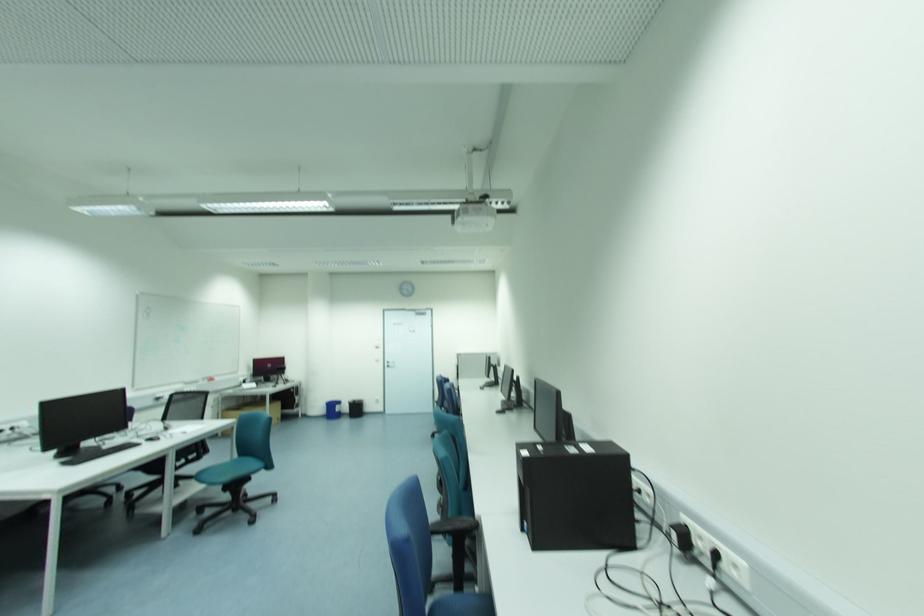
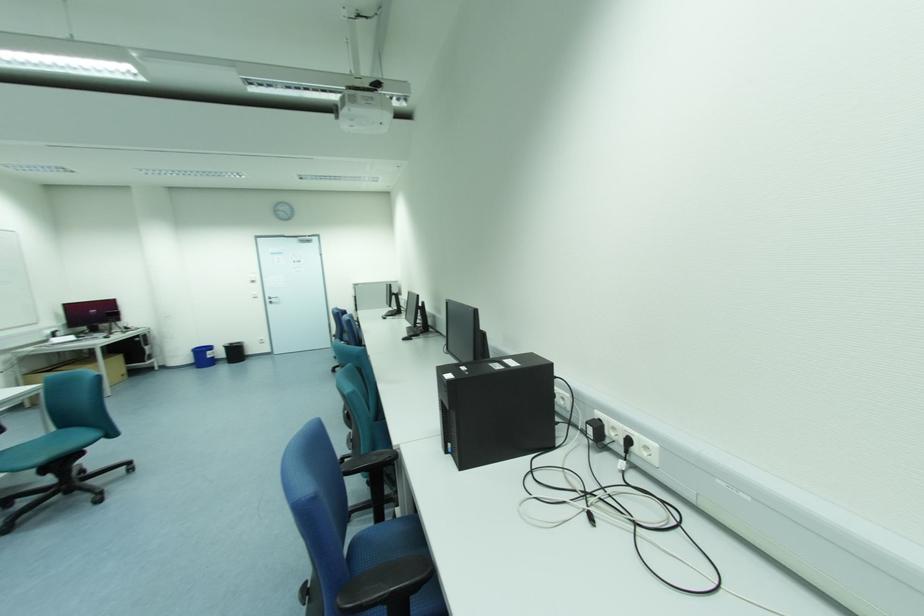
Question: How did the camera likely rotate?

Choices:
 (A) Left
 (B) Right
 (C) Up
 (D) Down

Answer: (B)